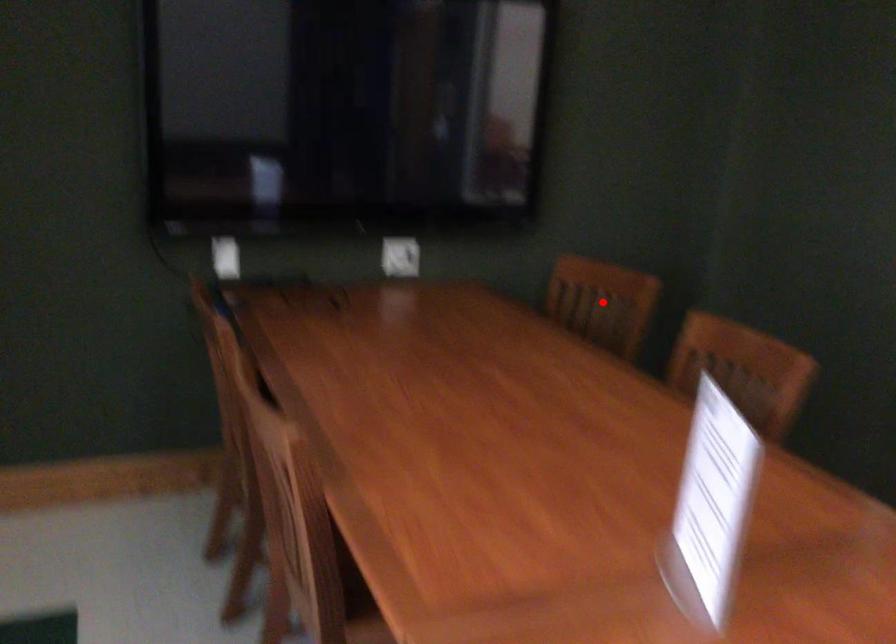
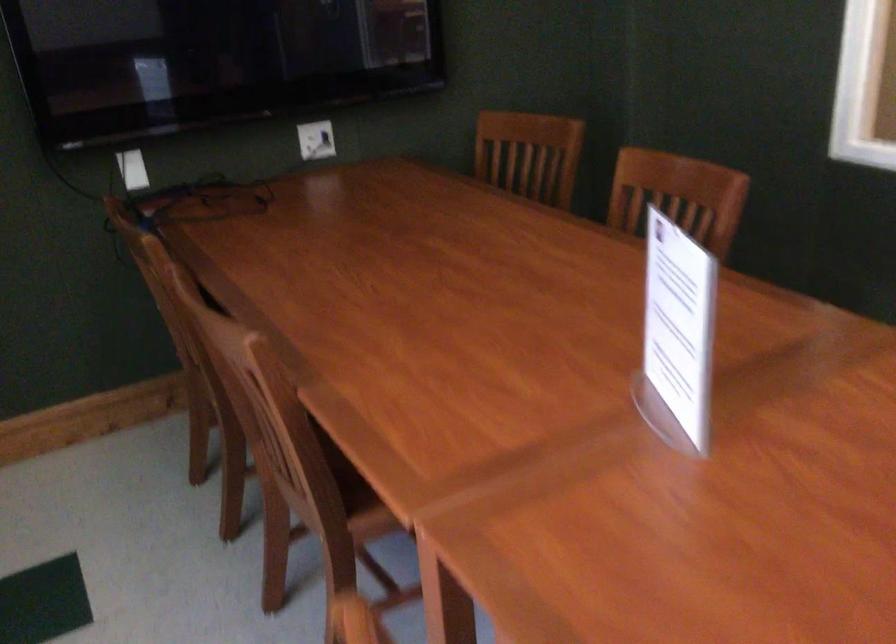
The point at the highlighted location is marked in the first image. Where is the corresponding point in the second image?

(529, 154)